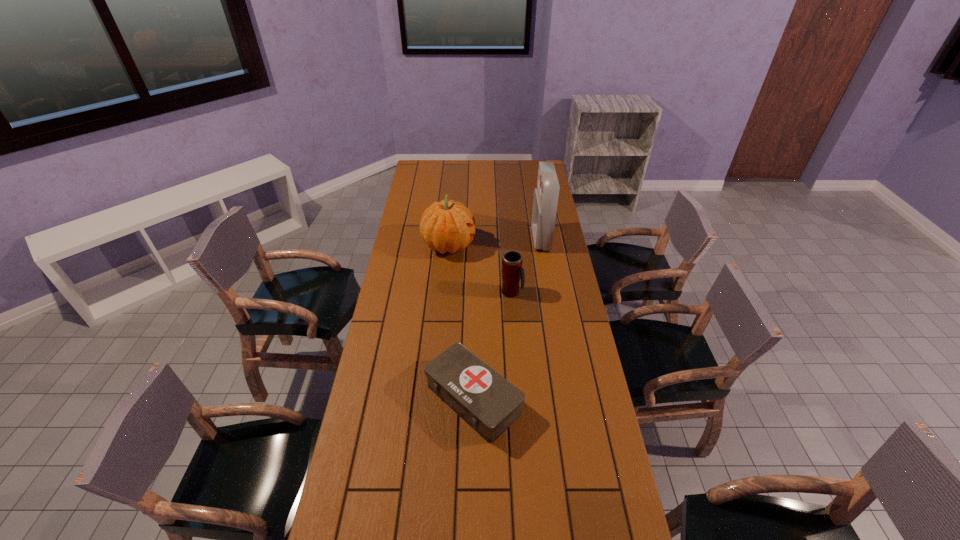
Where is `the farther first-aid kit`? the farther first-aid kit is located at coordinates (545, 201).

Identify the location of the rightmost object. The image size is (960, 540). click(545, 201).

The image size is (960, 540). What are the coordinates of `pumpkin` in the screenshot? It's located at (445, 226).

Locate an element on the screen. The height and width of the screenshot is (540, 960). the second shortest object is located at coordinates (512, 271).

The width and height of the screenshot is (960, 540). In order to click on the third farthest object in this screenshot , I will do `click(512, 271)`.

The height and width of the screenshot is (540, 960). Find the location of `the shortest object`. the shortest object is located at coordinates (485, 400).

Find the location of a particular element. the left first-aid kit is located at coordinates (485, 400).

At what (x,y) coordinates should I click in order to perform the action: click on free space located 0.350m on the front-facing side of the rightmost object. Please return your answer as a coordinate pair (x, y). The width and height of the screenshot is (960, 540). Looking at the image, I should click on (459, 239).

Identify the location of blank space located 0.230m on the front-facing side of the rightmost object. (485, 239).

Identify the location of free space located on the front-facing side of the rightmost object. This screenshot has height=540, width=960. (491, 239).